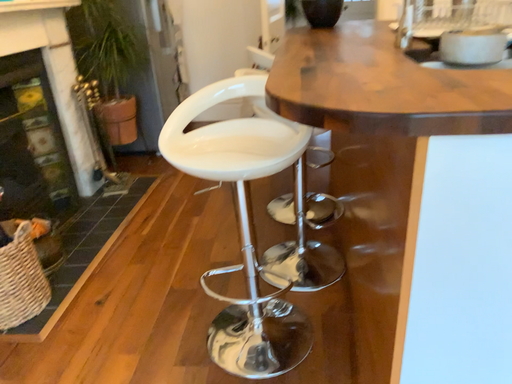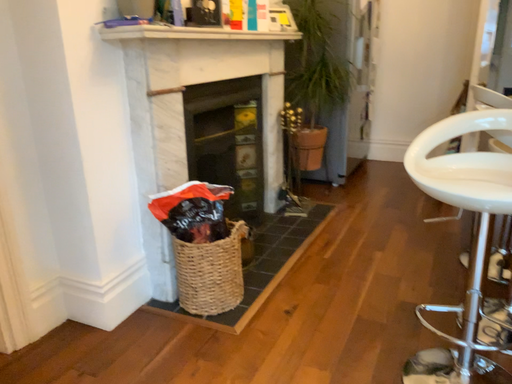
Question: How did the camera likely rotate when shooting the video?

Choices:
 (A) rotated left
 (B) rotated right

Answer: (A)